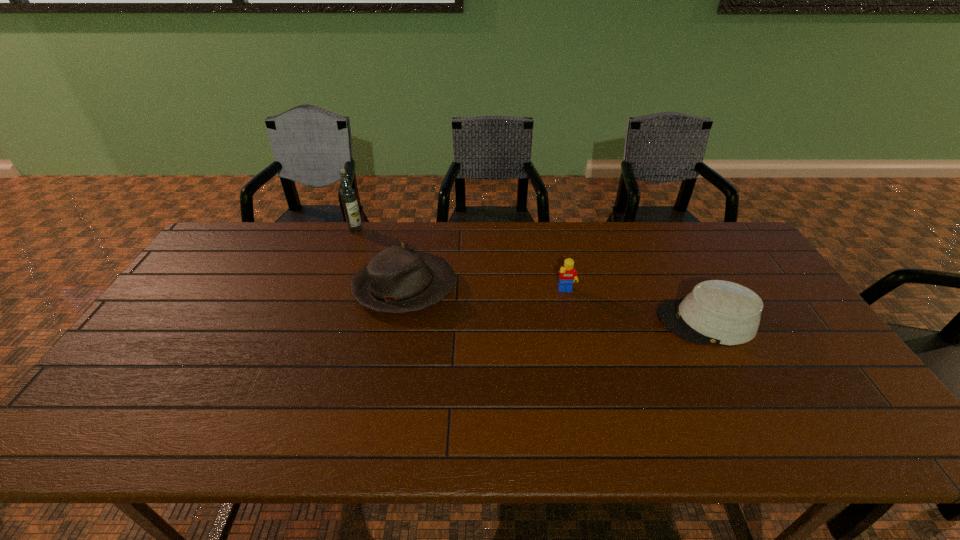
I want to click on vodka, so click(x=348, y=195).

Identify the location of the leftmost object. The image size is (960, 540). (348, 195).

The height and width of the screenshot is (540, 960). I want to click on the taller hat, so click(396, 280).

Identify the location of the second object from left to right. (396, 280).

Locate an element on the screen. The width and height of the screenshot is (960, 540). Lego is located at coordinates (567, 274).

At what (x,y) coordinates should I click in order to perform the action: click on the rightmost object. Please return your answer as a coordinate pair (x, y). Looking at the image, I should click on (719, 312).

This screenshot has height=540, width=960. Identify the location of the right hat. (719, 312).

You are a GUI agent. You are given a task and a screenshot of the screen. Output one action in this format:
    pyautogui.click(x=<x>, y=<y>)
    Task: Click on the vacant area situated on the label of the leftmost object
    This screenshot has width=960, height=540.
    Given the screenshot: What is the action you would take?
    pyautogui.click(x=329, y=301)

What are the coordinates of `vacant region located on the decorative side of the taller hat` in the screenshot? It's located at (578, 288).

Where is `free space located 0.110m on the face of the Lego`? This screenshot has width=960, height=540. free space located 0.110m on the face of the Lego is located at coordinates (573, 324).